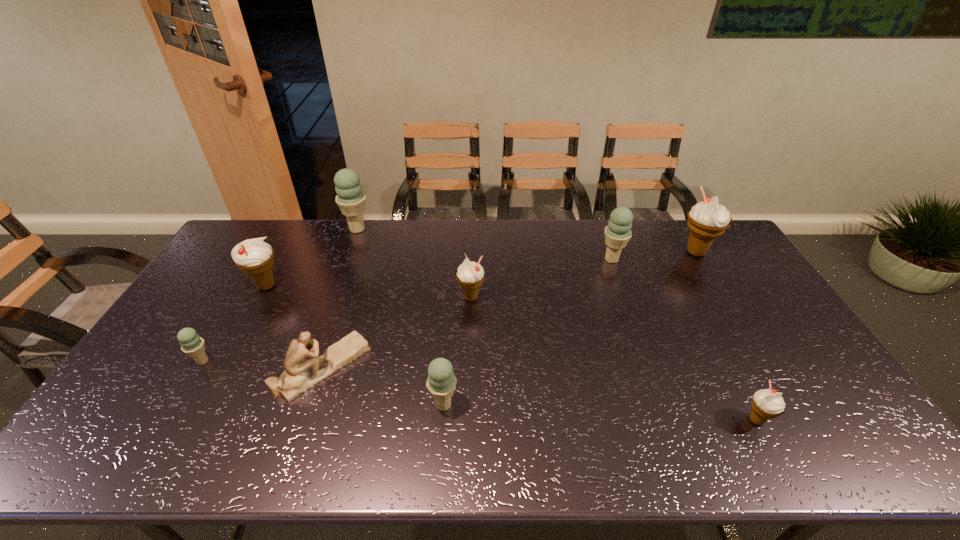
The height and width of the screenshot is (540, 960). What are the coordinates of `vacant space in between the sixth farthest icecream and the second farthest blue ice cream` in the screenshot? It's located at (407, 310).

Find the location of `object that is the sixth nearest to the sixth icecream from left to right`. object that is the sixth nearest to the sixth icecream from left to right is located at coordinates (350, 199).

Choose which object is the fifth nearest neighbor to the sixth icecream from right to left. Please provide its 2D coordinates. Your answer should be formatted as a tuple, i.e. [(x, y)], where the tuple contains the x and y coordinates of a point satisfying the conditions above.

[(441, 382)]

Point out which icecream is positioned as the fifth nearest to the second nearest blue ice cream. Please provide its 2D coordinates. Your answer should be formatted as a tuple, i.e. [(x, y)], where the tuple contains the x and y coordinates of a point satisfying the conditions above.

[(618, 232)]

Find the location of a particular element. icecream that stands as the fifth closest to the third smallest blue ice cream is located at coordinates (350, 199).

This screenshot has height=540, width=960. I want to click on blue ice cream that is the second closest to the leftmost white icecream, so click(x=350, y=199).

Find the location of `the closest blue ice cream relative to the third object from right to left`. the closest blue ice cream relative to the third object from right to left is located at coordinates (441, 382).

Where is `white icecream that stands as the fourth closest to the seventh object from left to right`? This screenshot has width=960, height=540. white icecream that stands as the fourth closest to the seventh object from left to right is located at coordinates (254, 257).

Choose which white icecream is the second nearest neighbor to the second nearest blue ice cream. Please provide its 2D coordinates. Your answer should be formatted as a tuple, i.e. [(x, y)], where the tuple contains the x and y coordinates of a point satisfying the conditions above.

[(470, 275)]

You are a GUI agent. You are given a task and a screenshot of the screen. Output one action in this format:
    pyautogui.click(x=<x>, y=<y>)
    Task: Click on the free space that satisfies the following two spatial constraints: 1. on the front-facing side of the third biggest blue ice cream; 2. on the right side of the figurine
    The height and width of the screenshot is (540, 960).
    Given the screenshot: What is the action you would take?
    310,405